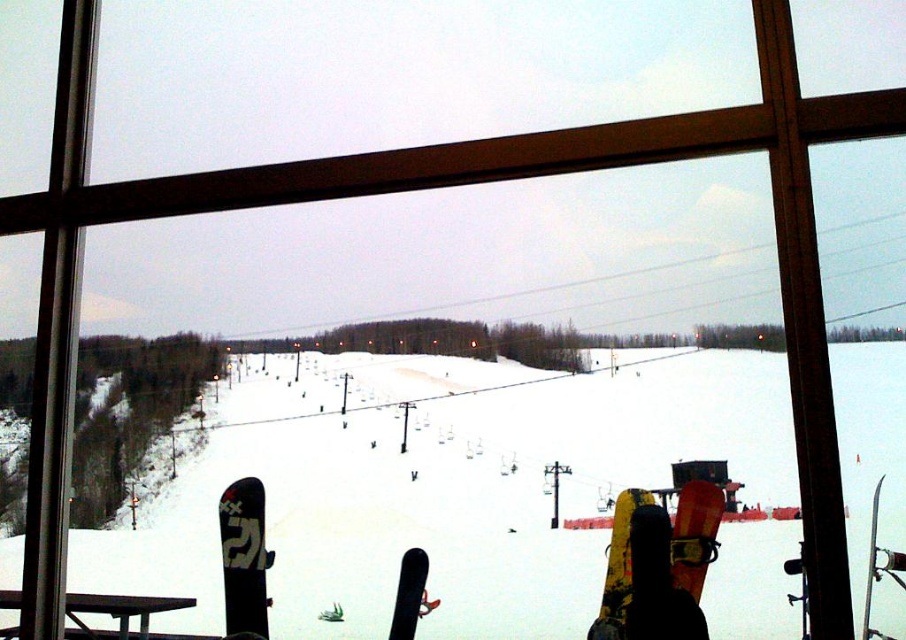
You are looking through the window at the ski resort. There are two points marked on the window frame at coordinates point (856, 492) and point (610, 572). Which point is closer to your eyes?

Point (856, 492) is closer to the camera than point (610, 572).

You are standing in front of the large window at the ski resort. There are several snowboards leaning against the window frame. You want to find the yellow matte snowboard at center. Based on its 2D coordinates, which part of the window frame is it closest to?

The yellow matte snowboard at center is located at coordinates 0.887 on the x axis and 0.684 on the y axis. Since the x coordinate is closer to 1, it is positioned near the right side of the window frame. The y coordinate is closer to 0.7, which is near the middle of the window vertically. Therefore, the yellow matte snowboard at center is closest to the right side of the window frame.

You are a delivery robot with a 12 inch wide package. You need to move from the window frame to the yellow matte snowboard at center without touching the white matte snow at center. Is there enough space for you to pass through?

The distance between the white matte snow at center and the yellow matte snowboard at center is 13.56 inches. Since the package is 12 inches wide, there is enough space for the robot to pass through without touching either object.